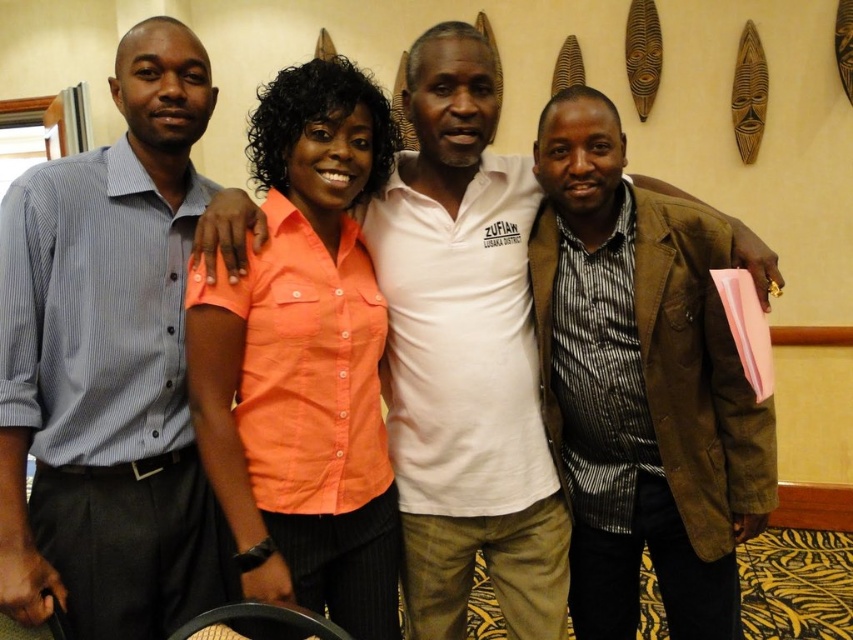
Where is the blue striped shirt at left located in the image?

The blue striped shirt at left is located at point (x=109, y=364) in the image.

Based on the scene description, where is the brown textured blazer at right located in the image?

The brown textured blazer at right is located at the 2D coordinates point (x=640, y=385) in the image.

You are a photographer adjusting the camera to capture a group photo. The camera has a focus range of 8 inches. Can you focus on both the white cotton shirt at center and the orange cotton shirt at center simultaneously?

The distance between the white cotton shirt at center and the orange cotton shirt at center is 8.52 inches, which exceeds the camera focus range of 8 inches. Therefore, you cannot focus on both simultaneously.